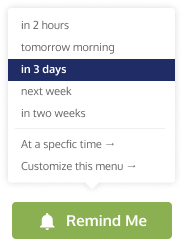
Locate an element on the screen. The height and width of the screenshot is (239, 183). gray border at the bottom is located at coordinates (57, 183).